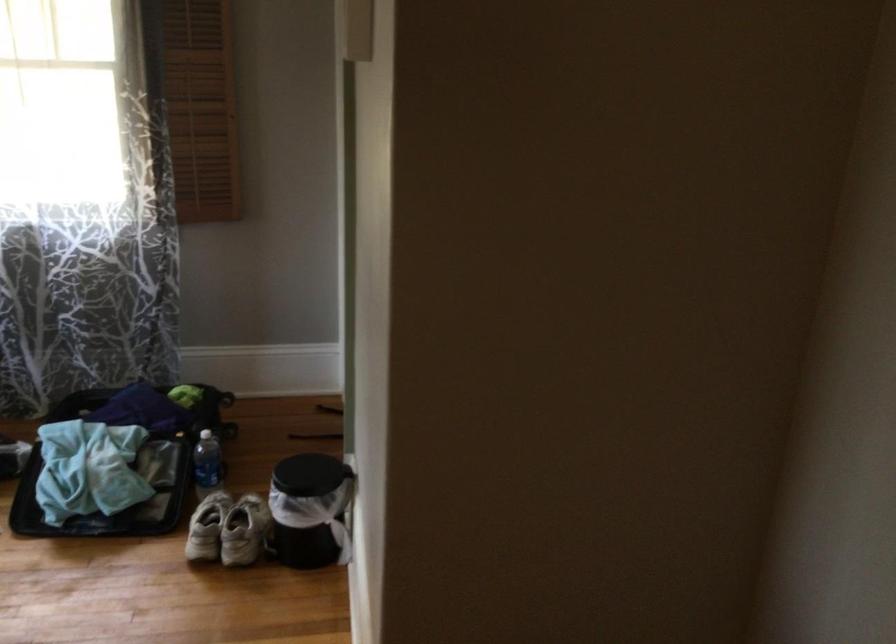
Which object does [309,509] point to?

It refers to a black trash can.